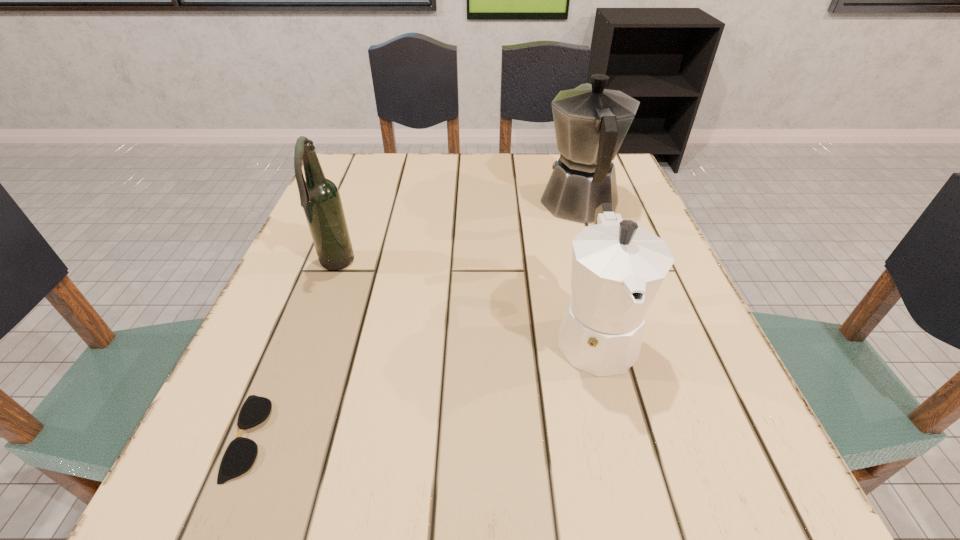
In the image, there is a desktop. Where is `blank space at the near edge`? Image resolution: width=960 pixels, height=540 pixels. blank space at the near edge is located at coordinates (621, 470).

In the image, there is a desktop. Where is `vacant space at the left edge`? The height and width of the screenshot is (540, 960). vacant space at the left edge is located at coordinates (300, 408).

The height and width of the screenshot is (540, 960). In order to click on free space at the right edge of the desktop in this screenshot , I will do `click(671, 310)`.

The height and width of the screenshot is (540, 960). I want to click on free region at the far left corner of the desktop, so click(390, 189).

The width and height of the screenshot is (960, 540). Find the location of `free space at the far right corner of the desktop`. free space at the far right corner of the desktop is located at coordinates (626, 189).

You are a GUI agent. You are given a task and a screenshot of the screen. Output one action in this format:
    pyautogui.click(x=<x>, y=<y>)
    Task: Click on the free space between the taller coffeepot and the third nearest object
    The height and width of the screenshot is (540, 960).
    Given the screenshot: What is the action you would take?
    pyautogui.click(x=458, y=235)

Find the location of a particular element. free point between the beer bottle and the taller coffeepot is located at coordinates (458, 235).

The width and height of the screenshot is (960, 540). I want to click on empty space that is in between the shortest object and the shorter coffeepot, so click(421, 386).

You are a GUI agent. You are given a task and a screenshot of the screen. Output one action in this format:
    pyautogui.click(x=<x>, y=<y>)
    Task: Click on the vacant area that lies between the farthest object and the shortest object
    This screenshot has height=540, width=960.
    Given the screenshot: What is the action you would take?
    pyautogui.click(x=415, y=321)

Identify the location of unoccupied position between the beer bottle and the nearer coffeepot. This screenshot has width=960, height=540. (466, 300).